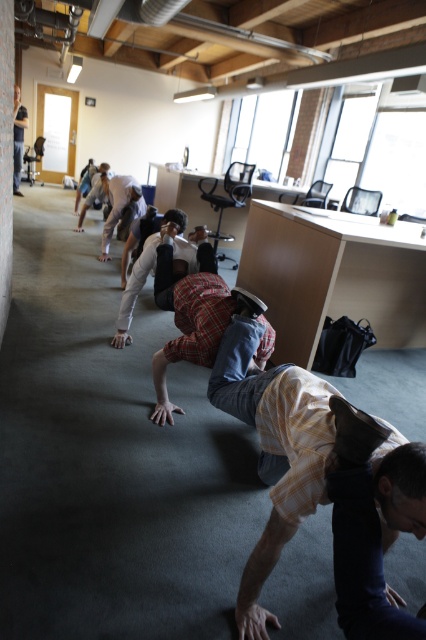
You are an office worker who wants to place a matte black laptop at upper left on the desk. However, there is a yellow plaid shorts at lower center in the way. Can you move the laptop to the desk without moving the shorts?

The yellow plaid shorts at lower center is positioned on the right side of the matte black laptop at upper left. Since the laptop is at the upper left and the shorts are to its right, moving the laptop to the desk would require shifting it towards the upper left direction, away from the shorts. Therefore, it is possible to move the laptop without disturbing the shorts.

You are standing in the center of the office and want to place a small potted plant exactly where the yellow plaid shorts at lower center are located. According to the coordinates provided, is this position suitable for placing the plant without obstructing the exercise area?

The yellow plaid shorts at lower center is located at point (271, 444), which indicates its position in the image. Since the individuals are exercising in the foreground on the floor, placing the plant where the shorts are might interfere with their movement area. Therefore, it is not suitable to place the plant there.